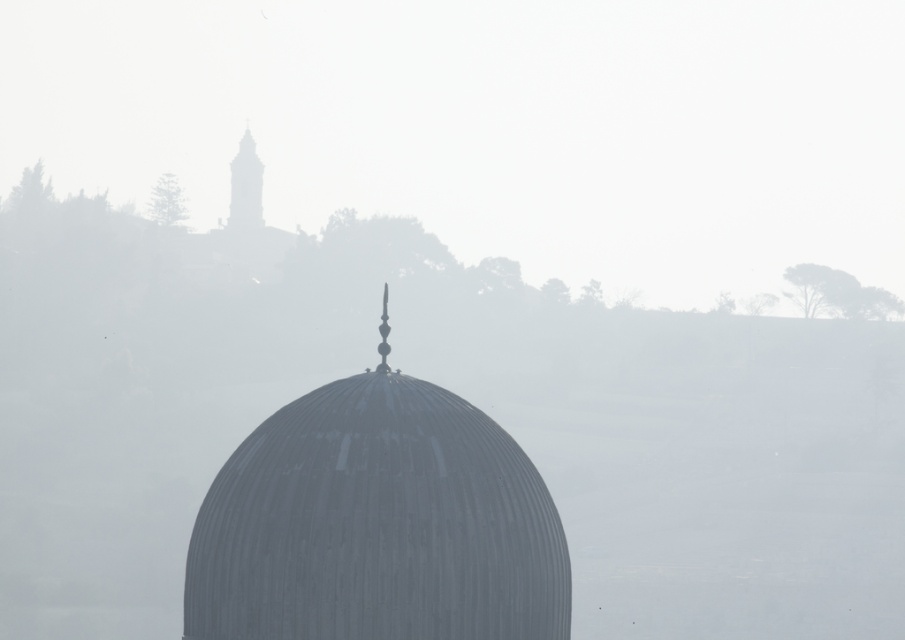
You are an architect analyzing the structure of the dome and tower in the image. Which object, the metallic dome at center or the smooth stone tower at upper left, has a larger size?

The metallic dome at center is bigger than the smooth stone tower at upper left.

You are an architect analyzing the spatial arrangement of the structures in the image. Based on the scene, which object is positioned to the right of the other between the metallic dome at center and the smooth stone tower at upper left?

The metallic dome at center is positioned to the right of the smooth stone tower at upper left.

You are a drone operator planning to fly a drone from the metallic dome at center to the smooth stone tower at upper left. Based on the scene, will the drone have a clear line of sight to the tower?

The metallic dome at center is in front of the smooth stone tower at upper left, so the drone will not have a clear line of sight to the tower because the dome is blocking the path.